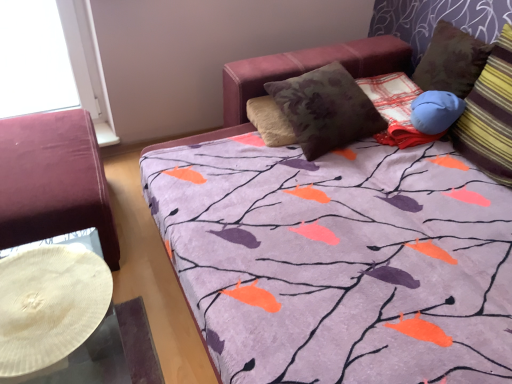
Question: Could you tell me if striped fabric pillow at right is facing velvet burgundy ottoman at left?

Choices:
 (A) no
 (B) yes

Answer: (A)

Question: Is striped fabric pillow at right positioned before velvet burgundy ottoman at left?

Choices:
 (A) yes
 (B) no

Answer: (A)

Question: From a real-world perspective, is striped fabric pillow at right located beneath velvet burgundy ottoman at left?

Choices:
 (A) yes
 (B) no

Answer: (B)

Question: Is striped fabric pillow at right facing away from velvet burgundy ottoman at left?

Choices:
 (A) yes
 (B) no

Answer: (B)

Question: From a real-world perspective, is striped fabric pillow at right on velvet burgundy ottoman at left?

Choices:
 (A) no
 (B) yes

Answer: (B)

Question: Is striped fabric pillow at right beside velvet burgundy ottoman at left?

Choices:
 (A) no
 (B) yes

Answer: (A)

Question: Can you confirm if velvet burgundy ottoman at left is shorter than striped fabric pillow at right?

Choices:
 (A) yes
 (B) no

Answer: (A)

Question: Considering the relative sizes of velvet burgundy ottoman at left and striped fabric pillow at right in the image provided, is velvet burgundy ottoman at left smaller than striped fabric pillow at right?

Choices:
 (A) yes
 (B) no

Answer: (B)

Question: Considering the relative positions of velvet burgundy ottoman at left and striped fabric pillow at right in the image provided, is velvet burgundy ottoman at left to the left of striped fabric pillow at right from the viewer's perspective?

Choices:
 (A) yes
 (B) no

Answer: (A)

Question: Does velvet burgundy ottoman at left have a greater height compared to striped fabric pillow at right?

Choices:
 (A) no
 (B) yes

Answer: (A)

Question: Is velvet burgundy ottoman at left thinner than striped fabric pillow at right?

Choices:
 (A) yes
 (B) no

Answer: (B)

Question: Considering the relative positions of velvet burgundy ottoman at left and striped fabric pillow at right in the image provided, is velvet burgundy ottoman at left in front of striped fabric pillow at right?

Choices:
 (A) no
 (B) yes

Answer: (A)

Question: Considering the relative positions of striped fabric pillow at right and velvet burgundy ottoman at left in the image provided, is striped fabric pillow at right to the left or to the right of velvet burgundy ottoman at left?

Choices:
 (A) left
 (B) right

Answer: (B)